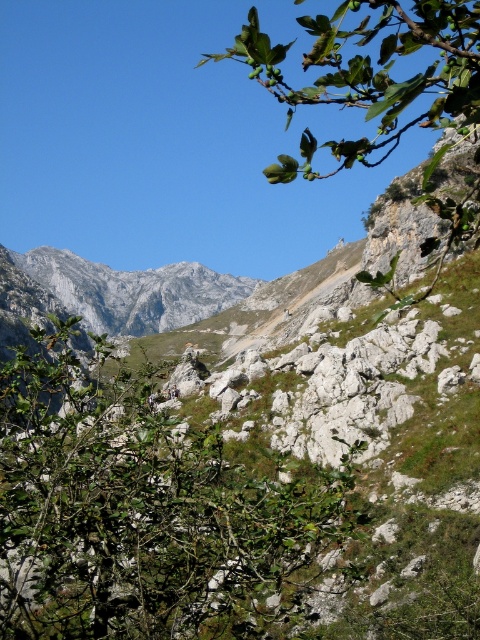
Question: Which of the following is the closest to the observer?

Choices:
 (A) green leafy shrub at center
 (B) green leafy branch at upper right

Answer: (B)

Question: Does green leafy shrub at center appear under green leafy branch at upper right?

Choices:
 (A) yes
 (B) no

Answer: (A)

Question: Considering the relative positions of green leafy shrub at center and green leafy branch at upper right in the image provided, where is green leafy shrub at center located with respect to green leafy branch at upper right?

Choices:
 (A) left
 (B) right

Answer: (A)

Question: Which object appears closest to the camera in this image?

Choices:
 (A) green leafy branch at upper right
 (B) green leafy shrub at center

Answer: (A)

Question: Is green leafy shrub at center above green leafy branch at upper right?

Choices:
 (A) yes
 (B) no

Answer: (B)